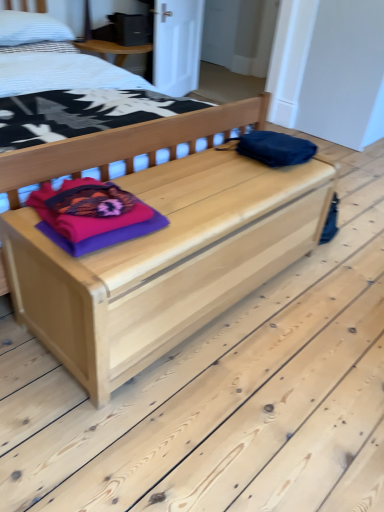
Where is `empty space that is to the right of purple fabric at center`? empty space that is to the right of purple fabric at center is located at coordinates (184, 215).